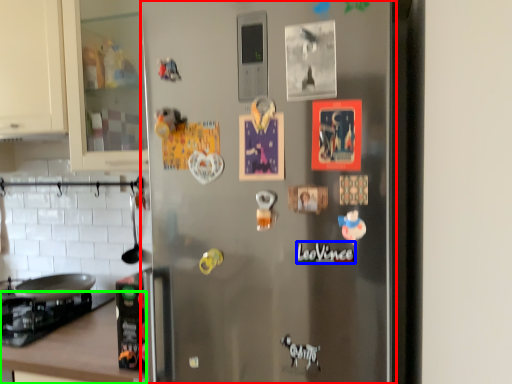
Question: Based on their relative distances, which object is farther from refrigerator (highlighted by a red box)? Choose from writing (highlighted by a blue box) and counter top (highlighted by a green box).

Choices:
 (A) writing
 (B) counter top

Answer: (B)